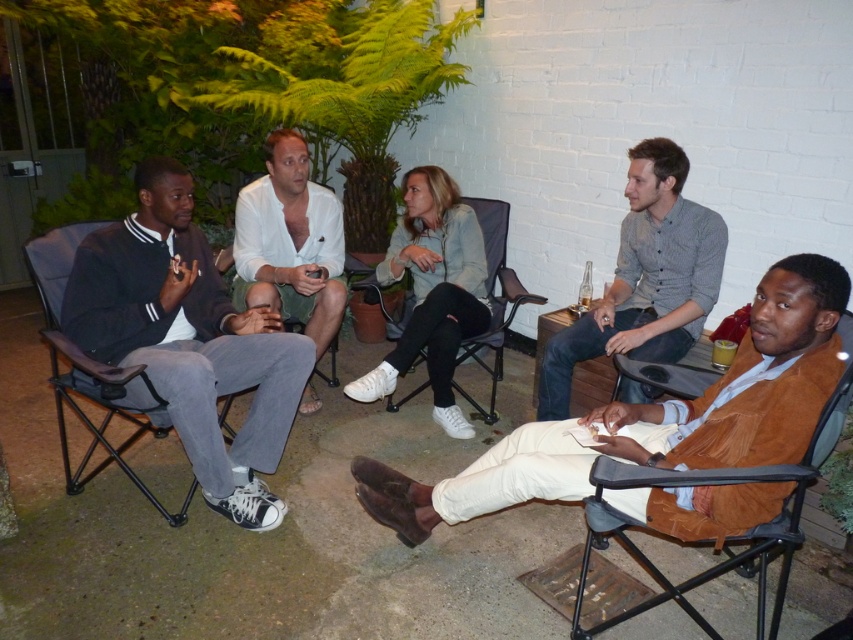
Question: Does dark gray cotton pants at left have a greater width compared to suede-like brown chair at lower right?

Choices:
 (A) yes
 (B) no

Answer: (B)

Question: Which object appears farthest from the camera in this image?

Choices:
 (A) gray button-up shirt at upper right
 (B) brown suede jacket at lower right

Answer: (A)

Question: Among these objects, which one is nearest to the camera?

Choices:
 (A) gray button-up shirt at upper right
 (B) white cotton shirt at center
 (C) brown suede jacket at lower right

Answer: (C)

Question: Which of the following is the farthest from the observer?

Choices:
 (A) dark gray cotton pants at left
 (B) brown suede jacket at lower right

Answer: (A)

Question: Is brown suede jacket at lower right wider than suede-like brown chair at lower right?

Choices:
 (A) yes
 (B) no

Answer: (A)

Question: Does brown suede jacket at lower right appear on the left side of gray button-up shirt at upper right?

Choices:
 (A) yes
 (B) no

Answer: (A)